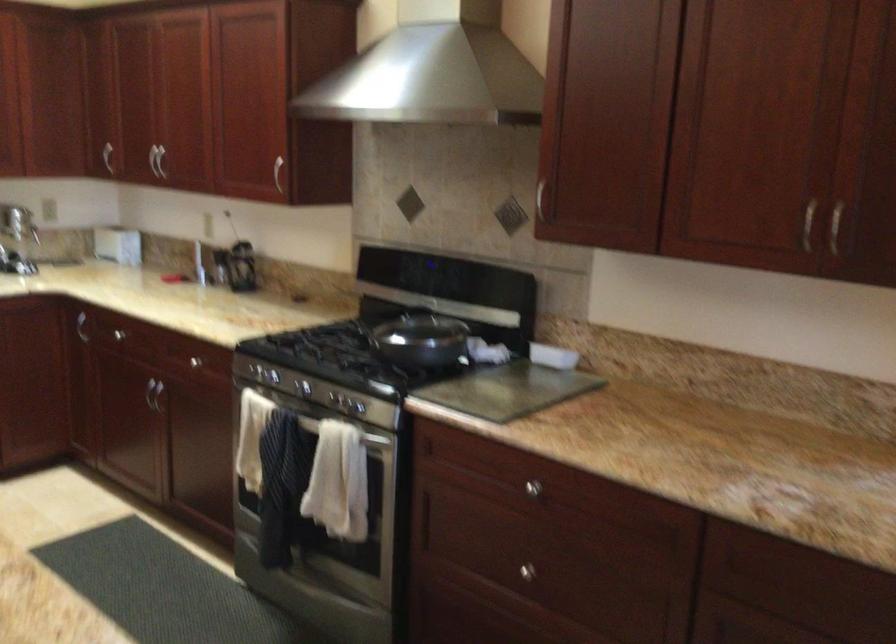
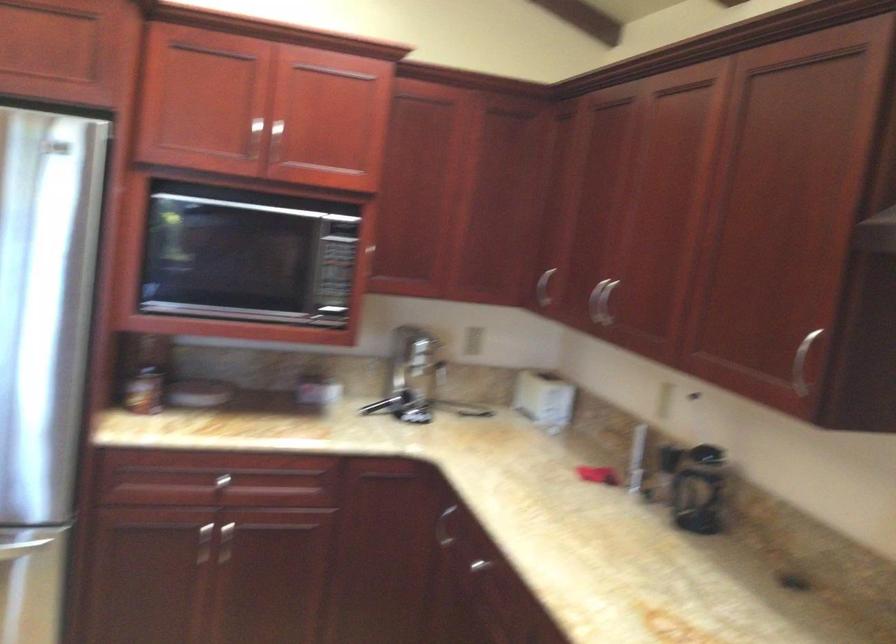
In the second image, find the point that corresponds to (x=114, y=229) in the first image.

(544, 398)